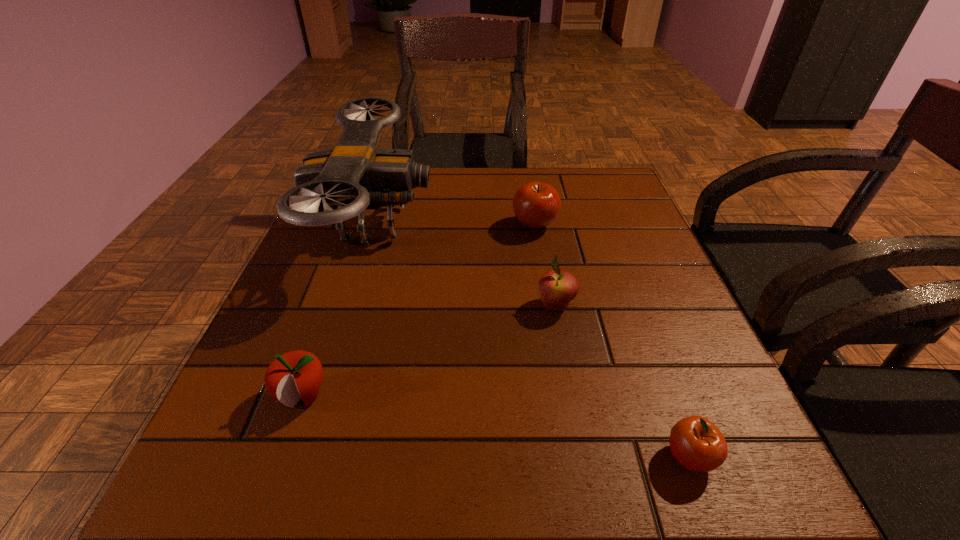
In the image, there is a desktop. Identify the location of vacant space at the far edge. The height and width of the screenshot is (540, 960). click(x=509, y=205).

Image resolution: width=960 pixels, height=540 pixels. In order to click on vacant space at the near edge of the desktop in this screenshot , I will do `click(495, 463)`.

In the image, there is a desktop. Find the location of `free space at the left edge`. free space at the left edge is located at coordinates (285, 290).

You are a GUI agent. You are given a task and a screenshot of the screen. Output one action in this format:
    pyautogui.click(x=<x>, y=<y>)
    Task: Click on the vacant area at the right edge
    The image size is (960, 540).
    Given the screenshot: What is the action you would take?
    pyautogui.click(x=626, y=273)

Locate an element on the screen. vacant region at the near left corner of the desktop is located at coordinates (215, 463).

Find the location of a particular element. The height and width of the screenshot is (540, 960). vacant space at the far right corner of the desktop is located at coordinates pyautogui.click(x=610, y=207).

The height and width of the screenshot is (540, 960). I want to click on free point between the third nearest apple and the second nearest apple, so pos(429,350).

Find the location of a particular element. Image resolution: width=960 pixels, height=540 pixels. vacant area that lies between the third nearest apple and the tallest object is located at coordinates (465, 266).

You are a GUI agent. You are given a task and a screenshot of the screen. Output one action in this format:
    pyautogui.click(x=<x>, y=<y>)
    Task: Click on the unoccupied area between the second nearest object and the third nearest apple
    The width and height of the screenshot is (960, 540).
    Given the screenshot: What is the action you would take?
    pyautogui.click(x=429, y=350)

In order to click on vacant area that lies between the third nearest apple and the second nearest object in this screenshot , I will do (429, 350).